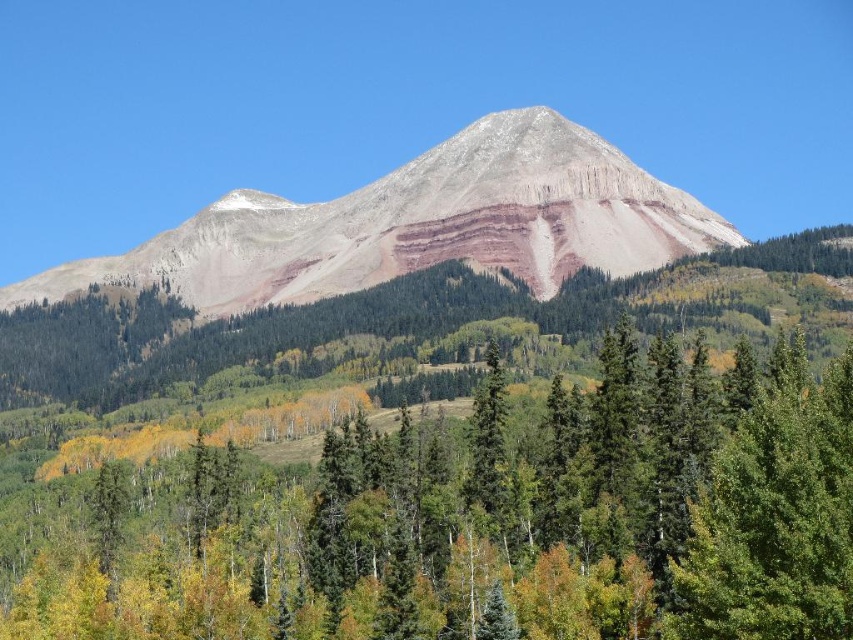
Is green matte tree at center to the right of rustic rock mountain at center from the viewer's perspective?

Yes, green matte tree at center is to the right of rustic rock mountain at center.

Who is taller, green matte tree at center or rustic rock mountain at center?

rustic rock mountain at center

Find the location of `green matte tree at center`. green matte tree at center is located at coordinates (486, 520).